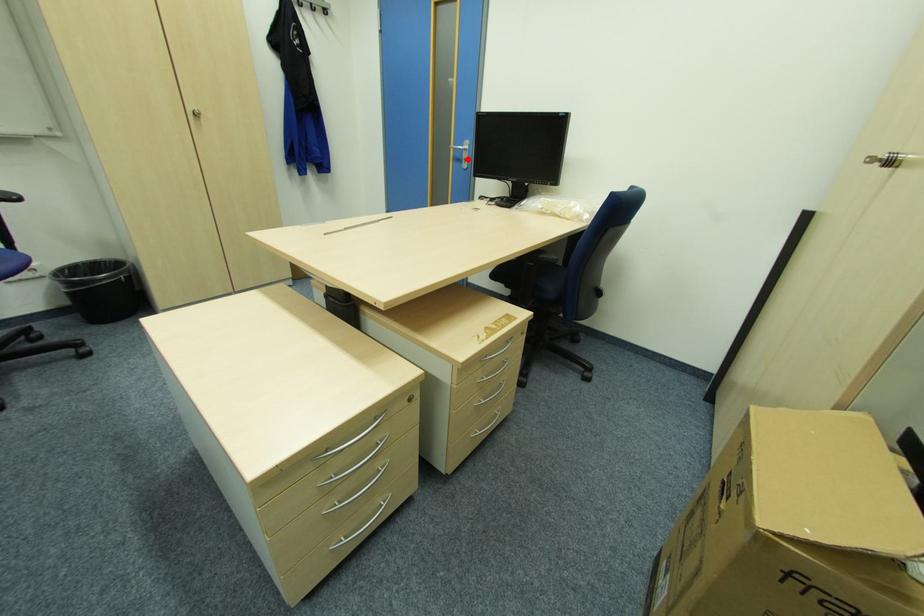
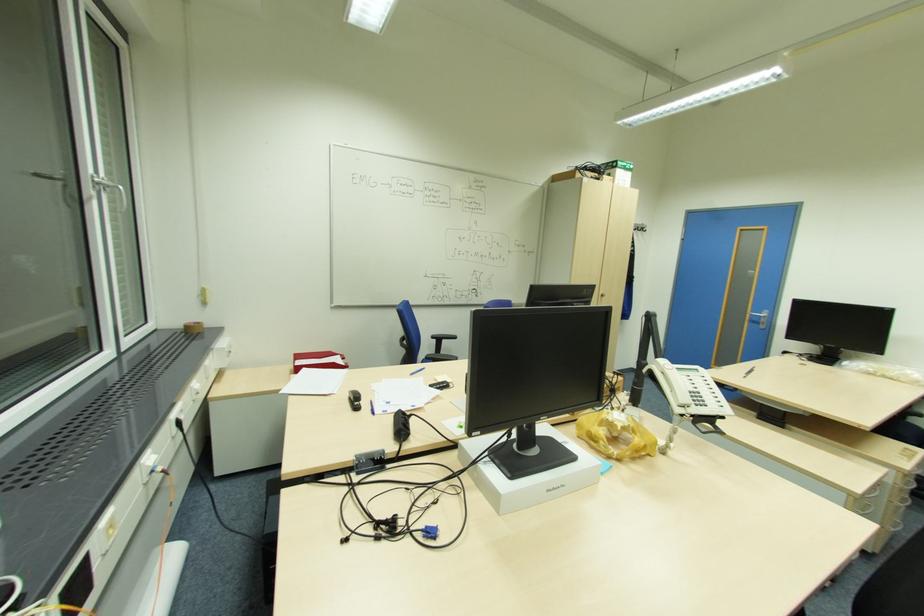
Question: I am providing you with two images of the same scene from different viewpoints. Image1 has a red point marked. In image2, the corresponding 3D location appears at what relative position? Reply with the corresponding letter.

Choices:
 (A) Closer
 (B) Farther

Answer: (B)